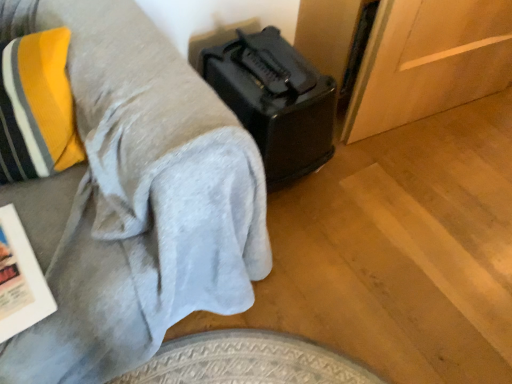
Measure the distance between point (17,290) and camera.

They are 31.81 inches apart.

Locate an element on the screen. The width and height of the screenshot is (512, 384). black plastic toaster at upper right is located at coordinates (139, 200).

This screenshot has height=384, width=512. Describe the element at coordinates (275, 101) in the screenshot. I see `black plastic suitcase at lower right` at that location.

The image size is (512, 384). I want to click on white paper magazine at lower left, so click(x=20, y=279).

Does black plastic suitcase at lower right have a smaller size compared to white paper magazine at lower left?

No.

Does black plastic suitcase at lower right have a greater height compared to white paper magazine at lower left?

Yes, black plastic suitcase at lower right is taller than white paper magazine at lower left.

How many degrees apart are the facing directions of white paper magazine at lower left and black plastic toaster at upper right?

There is a 3.75-degree angle between the facing directions of white paper magazine at lower left and black plastic toaster at upper right.

Between point (18, 221) and point (215, 308), which one is positioned behind?

The point (215, 308) is behind.

Does white paper magazine at lower left turn towards black plastic toaster at upper right?

Yes, white paper magazine at lower left faces towards black plastic toaster at upper right.

Which is more to the right, white paper magazine at lower left or black plastic toaster at upper right?

From the viewer's perspective, black plastic toaster at upper right appears more on the right side.

Can you tell me how much black plastic toaster at upper right and white paper magazine at lower left differ in facing direction?

The facing directions of black plastic toaster at upper right and white paper magazine at lower left are 3.75 degrees apart.

Does point (178, 158) come closer to viewer compared to point (20, 313)?

Yes, it is in front of point (20, 313).

From the image's perspective, which is above, black plastic toaster at upper right or white paper magazine at lower left?

black plastic toaster at upper right appears higher in the image.

Is black plastic toaster at upper right beside white paper magazine at lower left?

No, black plastic toaster at upper right is not beside white paper magazine at lower left.

From the image's perspective, is black plastic suitcase at lower right located above black plastic toaster at upper right?

Yes, from the image's perspective, black plastic suitcase at lower right is over black plastic toaster at upper right.

Is black plastic suitcase at lower right not inside black plastic toaster at upper right?

black plastic suitcase at lower right is positioned outside black plastic toaster at upper right.

At what (x,y) coordinates should I click in order to perform the action: click on furniture above the black plastic suitcase at lower right (from a real-world perspective). Please return your answer as a coordinate pair (x, y). The height and width of the screenshot is (384, 512). Looking at the image, I should click on (x=139, y=200).

Is point (15, 288) positioned after point (332, 88)?

No, (15, 288) is in front of (332, 88).

How many degrees apart are the facing directions of white paper magazine at lower left and black plastic suitcase at lower right?

There is a 5.58-degree angle between the facing directions of white paper magazine at lower left and black plastic suitcase at lower right.

Considering the sizes of objects white paper magazine at lower left and black plastic suitcase at lower right in the image provided, who is bigger, white paper magazine at lower left or black plastic suitcase at lower right?

black plastic suitcase at lower right is bigger.

Is white paper magazine at lower left positioned far away from black plastic suitcase at lower right?

No, there isn't a large distance between white paper magazine at lower left and black plastic suitcase at lower right.

Between black plastic toaster at upper right and black plastic suitcase at lower right, which one has more height?

With more height is black plastic toaster at upper right.

Considering the relative positions of black plastic toaster at upper right and black plastic suitcase at lower right in the image provided, is black plastic toaster at upper right to the left of black plastic suitcase at lower right from the viewer's perspective?

Indeed, black plastic toaster at upper right is positioned on the left side of black plastic suitcase at lower right.

How far apart are black plastic toaster at upper right and black plastic suitcase at lower right?

black plastic toaster at upper right and black plastic suitcase at lower right are 17.43 inches apart.

Which object is closer to the camera taking this photo, black plastic toaster at upper right or black plastic suitcase at lower right?

black plastic toaster at upper right is more forward.

Locate an element on the screen. This screenshot has width=512, height=384. magazine located above the black plastic suitcase at lower right (from a real-world perspective) is located at coordinates (20, 279).

Find the location of a particular element. This screenshot has width=512, height=384. magazine to the left of black plastic toaster at upper right is located at coordinates (20, 279).

Which object lies further to the anchor point black plastic toaster at upper right, black plastic suitcase at lower right or white paper magazine at lower left?

black plastic suitcase at lower right is further to black plastic toaster at upper right.

When comparing their distances from black plastic suitcase at lower right, does black plastic toaster at upper right or white paper magazine at lower left seem further?

The object further to black plastic suitcase at lower right is white paper magazine at lower left.

Based on their spatial positions, is black plastic suitcase at lower right or black plastic toaster at upper right closer to white paper magazine at lower left?

black plastic toaster at upper right.

When comparing their distances from white paper magazine at lower left, does black plastic toaster at upper right or black plastic suitcase at lower right seem further?

black plastic suitcase at lower right is further to white paper magazine at lower left.

When comparing their distances from black plastic suitcase at lower right, does white paper magazine at lower left or black plastic toaster at upper right seem closer?

Among the two, black plastic toaster at upper right is located nearer to black plastic suitcase at lower right.

When comparing their distances from black plastic toaster at upper right, does white paper magazine at lower left or black plastic suitcase at lower right seem further?

Among the two, black plastic suitcase at lower right is located further to black plastic toaster at upper right.

Where is `furniture situated between white paper magazine at lower left and black plastic suitcase at lower right from left to right`? furniture situated between white paper magazine at lower left and black plastic suitcase at lower right from left to right is located at coordinates (139, 200).